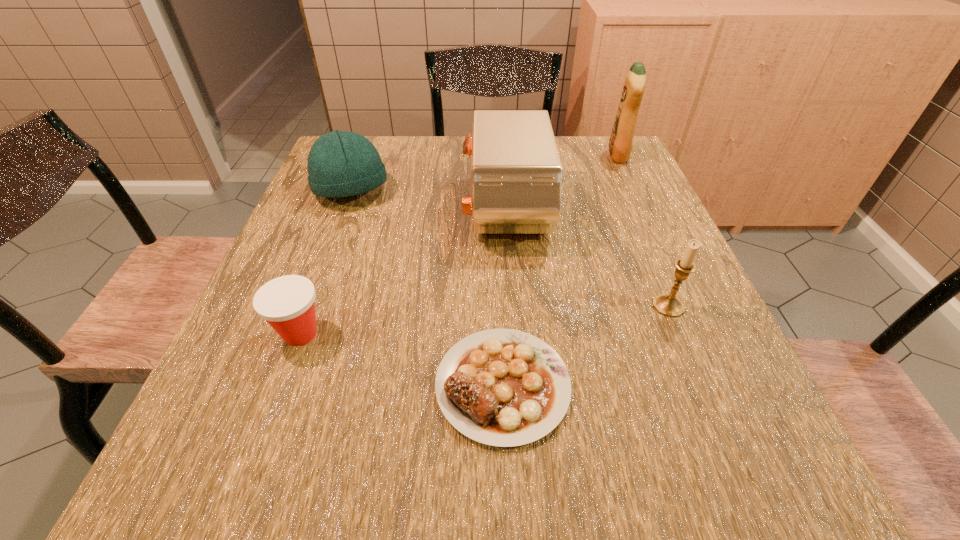
Where is `vacant region at the right edge of the desktop`? Image resolution: width=960 pixels, height=540 pixels. vacant region at the right edge of the desktop is located at coordinates (679, 246).

This screenshot has width=960, height=540. I want to click on free space at the far right corner, so click(x=575, y=150).

Identify the location of vacant area that lies between the candle holder and the tallest object. The image size is (960, 540). (x=643, y=231).

The width and height of the screenshot is (960, 540). In order to click on vacant area between the beanie and the shortest object in this screenshot , I will do `click(427, 287)`.

You are a GUI agent. You are given a task and a screenshot of the screen. Output one action in this format:
    pyautogui.click(x=<x>, y=<y>)
    Task: Click on the vacant area that lies between the second tallest object and the steak
    
    Given the screenshot: What is the action you would take?
    pyautogui.click(x=504, y=298)

Where is `empty location between the toaster oven and the beanie`? The width and height of the screenshot is (960, 540). empty location between the toaster oven and the beanie is located at coordinates (428, 200).

I want to click on vacant point located between the beanie and the fifth tallest object, so click(x=325, y=261).

This screenshot has height=540, width=960. What are the coordinates of `vacant area that lies between the candle holder and the beanie` in the screenshot? It's located at (510, 248).

Locate an element on the screen. The image size is (960, 540). vacant area that lies between the steak and the Dixie cup is located at coordinates (401, 359).

In order to click on vacant region between the shortest object and the toaster oven in this screenshot , I will do `click(504, 298)`.